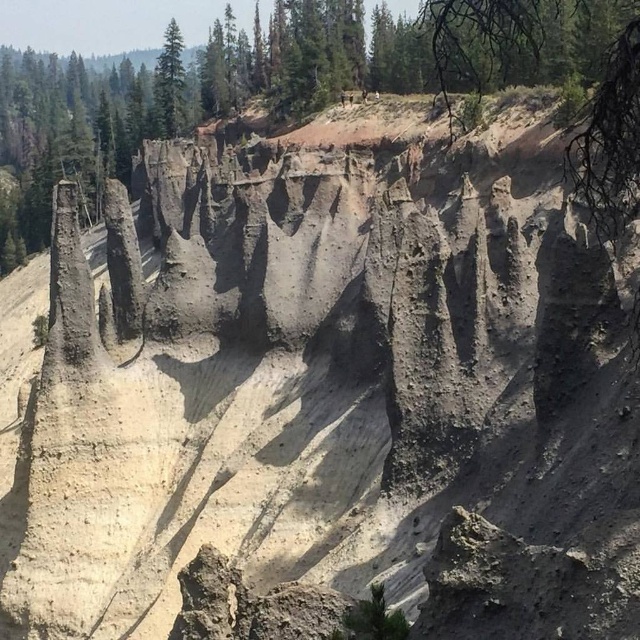
You are a hiker standing at the base of the dull gray rock formation at center and the green matte tree at upper center. Which object is taller?

The dull gray rock formation at center is much taller than the green matte tree at upper center.